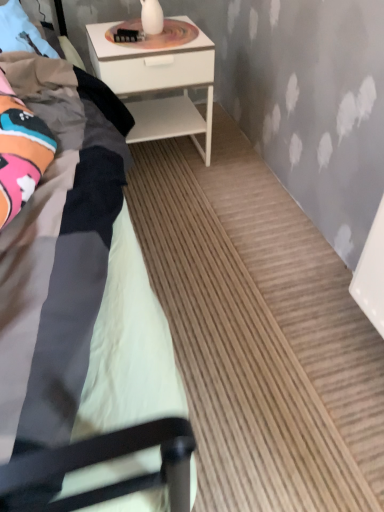
Image resolution: width=384 pixels, height=512 pixels. In order to click on vacant space underneath white glossy nightstand at upper center (from a real-world perspective) in this screenshot , I will do `click(163, 160)`.